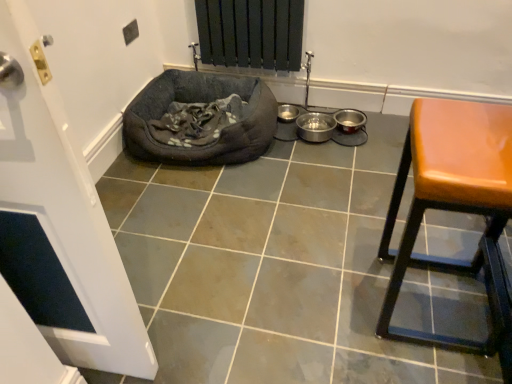
Question: In terms of height, does matte gray tile at center look taller or shorter compared to dark gray fabric dog bed at lower left?

Choices:
 (A) tall
 (B) short

Answer: (B)

Question: In the image, is matte gray tile at center positioned in front of or behind dark gray fabric dog bed at lower left?

Choices:
 (A) behind
 (B) front

Answer: (B)

Question: Estimate the real-world distances between objects in this image. Which object is farther from the matte gray tile at center?

Choices:
 (A) dark gray fabric dog bed at lower left
 (B) leatherette stool at right

Answer: (A)

Question: Which object is positioned closest to the leatherette stool at right?

Choices:
 (A) dark gray fabric dog bed at lower left
 (B) matte gray tile at center

Answer: (B)